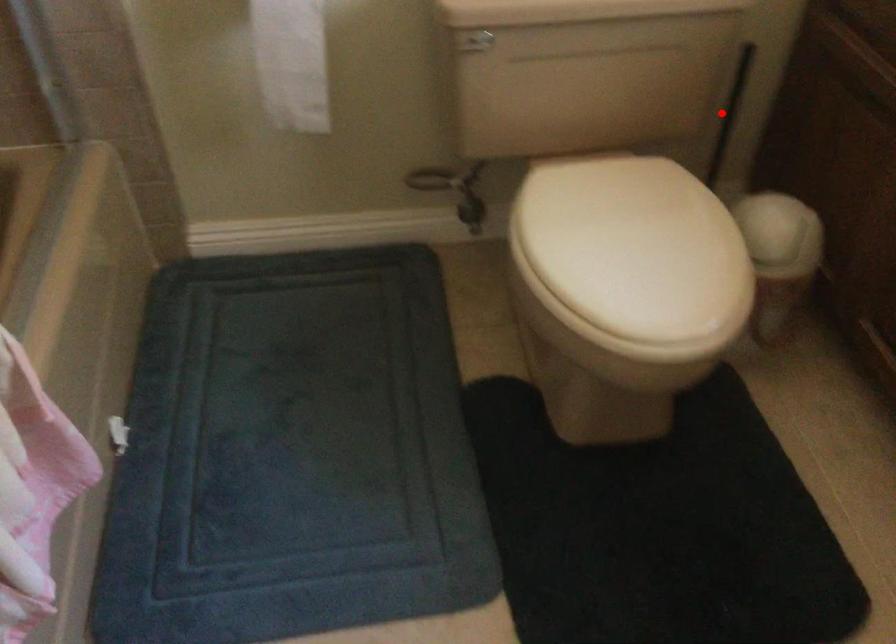
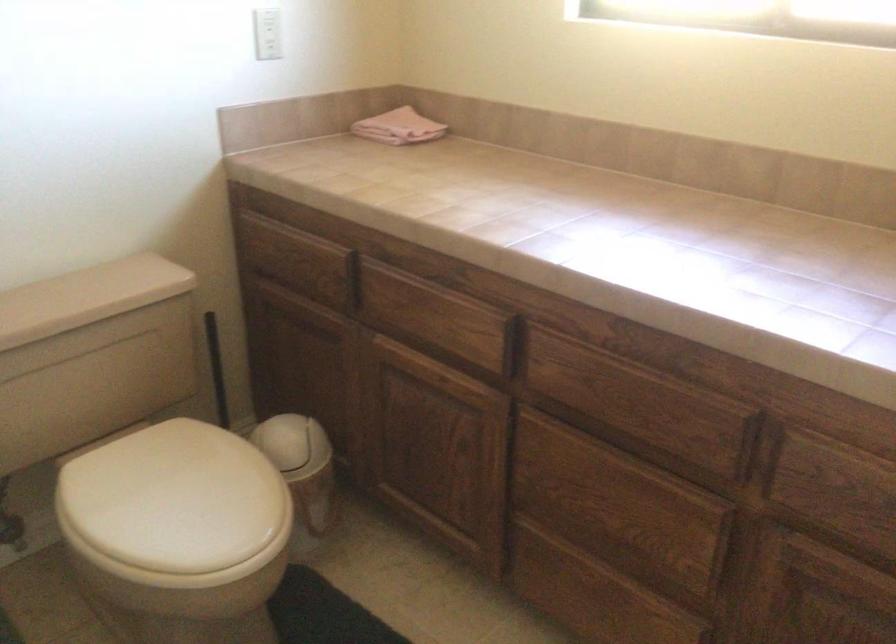
The point at the highlighted location is marked in the first image. Where is the corresponding point in the second image?

(216, 368)